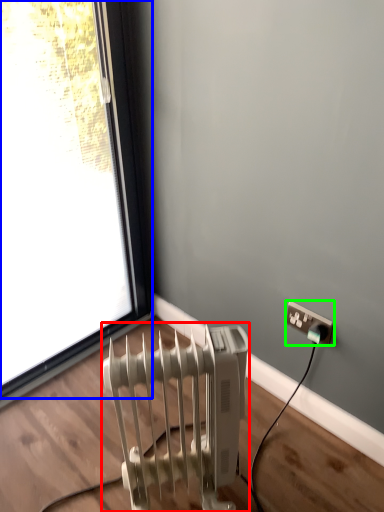
Question: Which object is positioned closest to radiator (highlighted by a red box)? Select from window (highlighted by a blue box) and power plugs and sockets (highlighted by a green box).

Choices:
 (A) window
 (B) power plugs and sockets

Answer: (B)